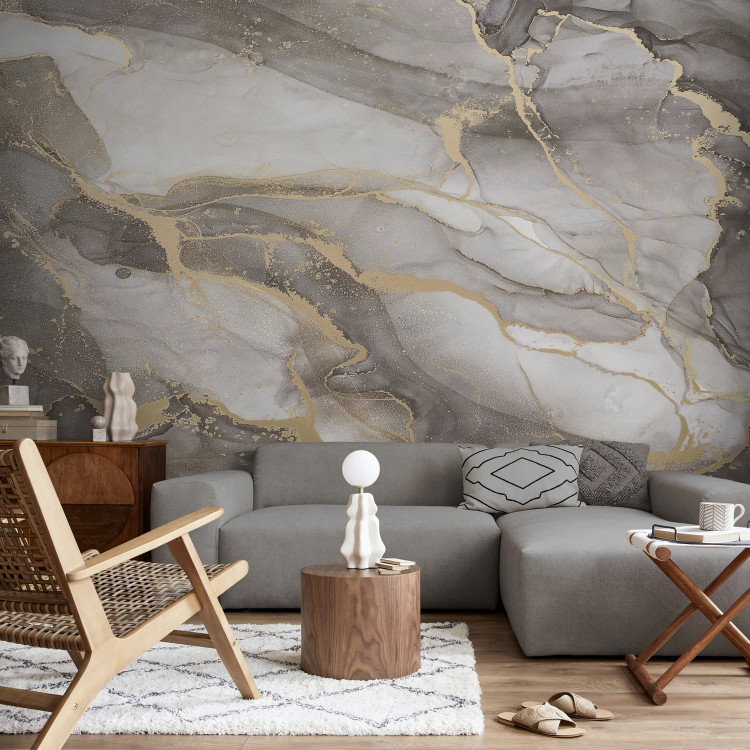
At what (x,y) coordinates should I click in order to perform the action: click on 1 tray. Please return your answer as a coordinate pair (x, y). The height and width of the screenshot is (750, 750). Looking at the image, I should click on (715, 618).